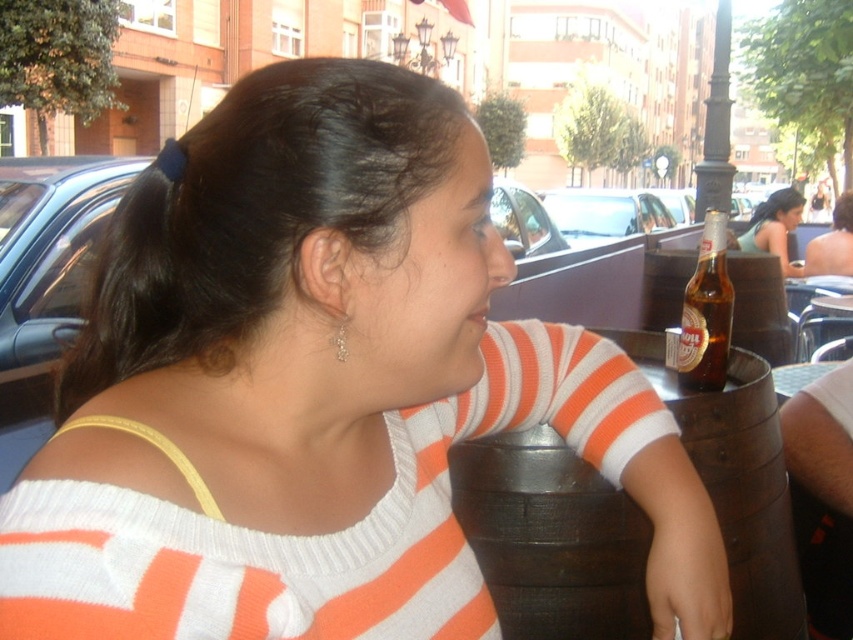
Question: Can you confirm if brown wooden barrel at lower right is bigger than brown glass bottle at upper right?

Choices:
 (A) yes
 (B) no

Answer: (A)

Question: Which of the following is the closest to the observer?

Choices:
 (A) brown glass bottle at upper right
 (B) matte black bottle at upper right
 (C) matte orange sweater at center
 (D) brown wooden barrel at lower right

Answer: (D)

Question: Considering the real-world distances, which object is closest to the matte black bottle at upper right?

Choices:
 (A) brown glass bottle at upper right
 (B) matte orange sweater at center

Answer: (B)

Question: Can you confirm if matte black bottle at upper right is positioned above matte orange sweater at center?

Choices:
 (A) no
 (B) yes

Answer: (A)

Question: Does brown wooden barrel at lower right have a larger size compared to brown glass bottle at upper right?

Choices:
 (A) yes
 (B) no

Answer: (A)

Question: Among these points, which one is farthest from the camera?

Choices:
 (A) (782, 598)
 (B) (837, 218)
 (C) (697, 349)

Answer: (B)